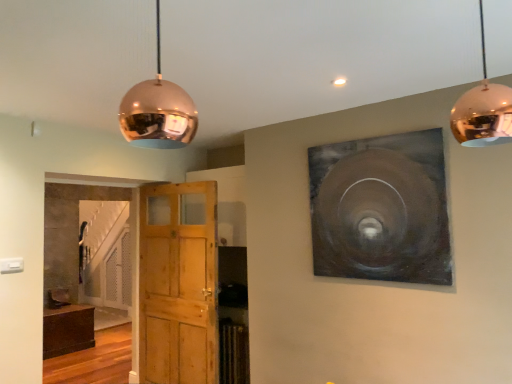
Question: Is point (73, 331) closer or farther from the camera than point (154, 188)?

Choices:
 (A) closer
 (B) farther

Answer: (B)

Question: Would you say dark wood cabinet at lower left is inside or outside wooden door at center?

Choices:
 (A) outside
 (B) inside

Answer: (A)

Question: Which is nearer to the dark wood cabinet at lower left?

Choices:
 (A) copper reflective sphere at upper left, the first lamp viewed from the left
 (B) metallic silver painting at upper right
 (C) wooden door at center
 (D) copper reflective sphere at upper right, the 2th lamp in the left-to-right sequence

Answer: (C)

Question: Estimate the real-world distances between objects in this image. Which object is farther from the copper reflective sphere at upper left, the second lamp viewed from the right?

Choices:
 (A) dark wood cabinet at lower left
 (B) metallic silver painting at upper right
 (C) copper reflective sphere at upper right, the 2th lamp in the left-to-right sequence
 (D) wooden door at center

Answer: (A)